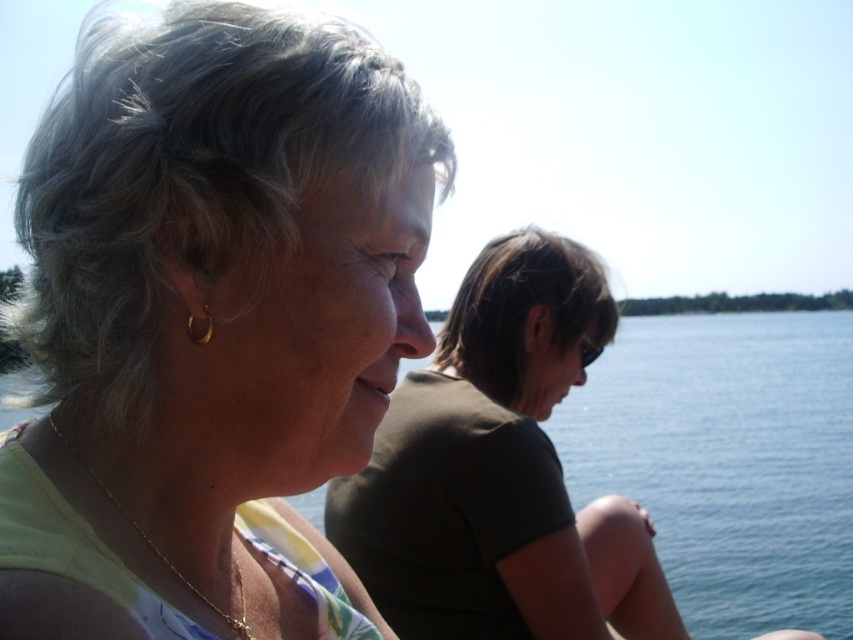
You are a photographer standing 2 meters away from the two people in the scene. You want to take a photo that includes both the matte yellow blouse at center and the dark brown fabric at center. Can you fit both into your camera frame if your camera has a maximum field of view of 2 meters?

The matte yellow blouse at center and dark brown fabric at center are 1.64 meters apart, which is within the camera frame of 2 meters. Therefore, you can fit both into your camera frame.

You are a fashion designer analyzing the outfits in the image. Which of the two items, the matte yellow blouse at center or the dark brown fabric at center, has a shorter length?

The matte yellow blouse at center is shorter than the dark brown fabric at center.